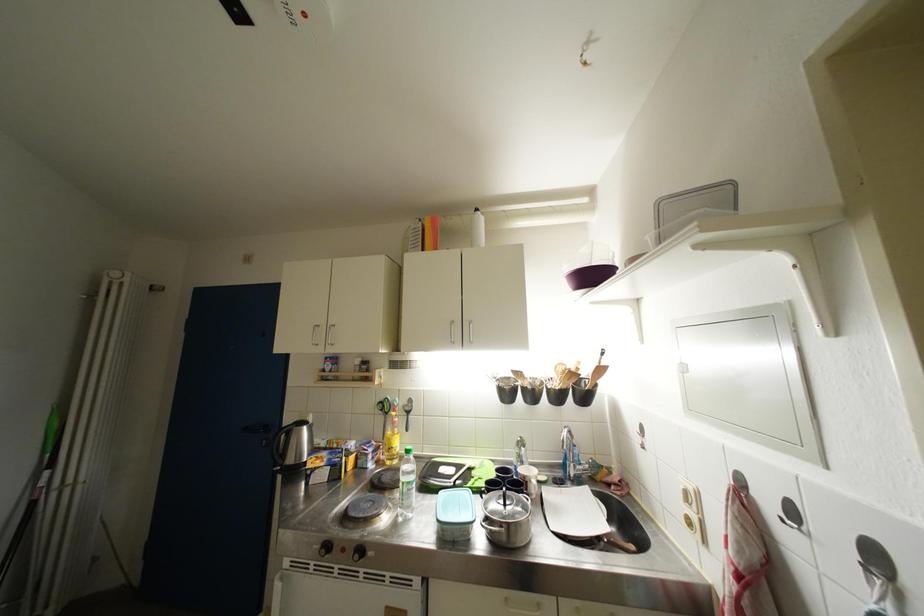
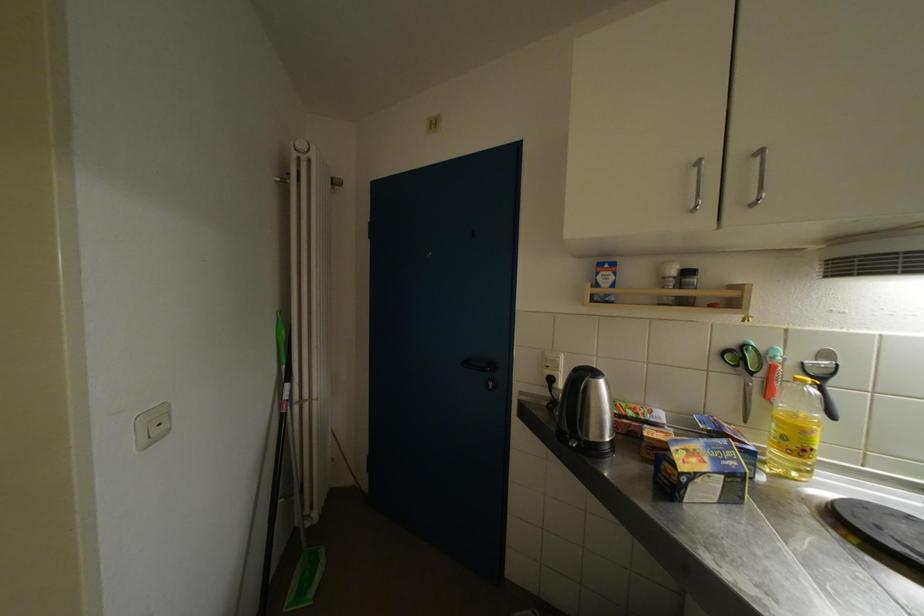
The images are taken continuously from a first-person perspective. In which direction are you moving?

The cameraman moved toward left, forward.